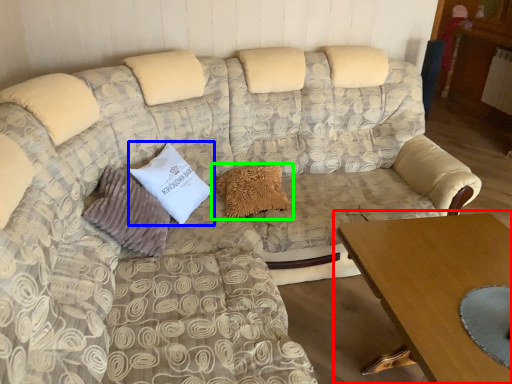
Question: Estimate the real-world distances between objects in this image. Which object is farther from table (highlighted by a red box), pillow (highlighted by a blue box) or pillow (highlighted by a green box)?

Choices:
 (A) pillow
 (B) pillow

Answer: (A)